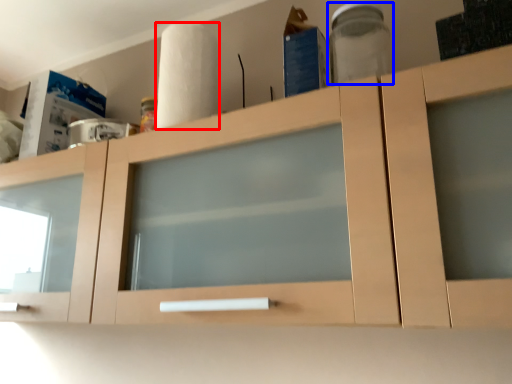
Question: Which point is further to the camera, paper towel (highlighted by a red box) or glass jar (highlighted by a blue box)?

Choices:
 (A) paper towel
 (B) glass jar

Answer: (A)